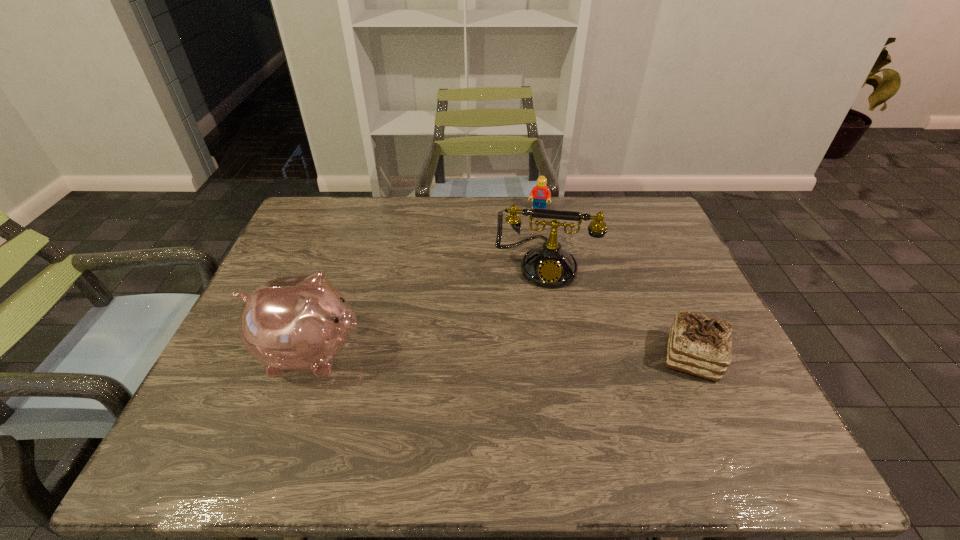
You are a GUI agent. You are given a task and a screenshot of the screen. Output one action in this format:
    pyautogui.click(x=<x>, y=<y>)
    Task: Click on the free space between the telephone and the rightmost object
    This screenshot has height=540, width=960.
    Given the screenshot: What is the action you would take?
    click(x=618, y=311)

This screenshot has height=540, width=960. I want to click on empty location between the telephone and the leftmost object, so click(x=428, y=308).

Find the location of a particular element. This screenshot has width=960, height=540. empty location between the second farthest object and the leftmost object is located at coordinates (428, 308).

Locate an element on the screen. Image resolution: width=960 pixels, height=540 pixels. empty space between the leftmost object and the farthest object is located at coordinates (425, 281).

Where is `object that can be found as the second closest to the chocolate cake`? The height and width of the screenshot is (540, 960). object that can be found as the second closest to the chocolate cake is located at coordinates (x=540, y=193).

Locate which object ranks in proximity to the Lego. Please provide its 2D coordinates. Your answer should be formatted as a tuple, i.e. [(x, y)], where the tuple contains the x and y coordinates of a point satisfying the conditions above.

[(549, 266)]

Find the location of a particular element. free space that satisfies the following two spatial constraints: 1. on the front side of the farthest object; 2. on the right side of the rightmost object is located at coordinates (564, 357).